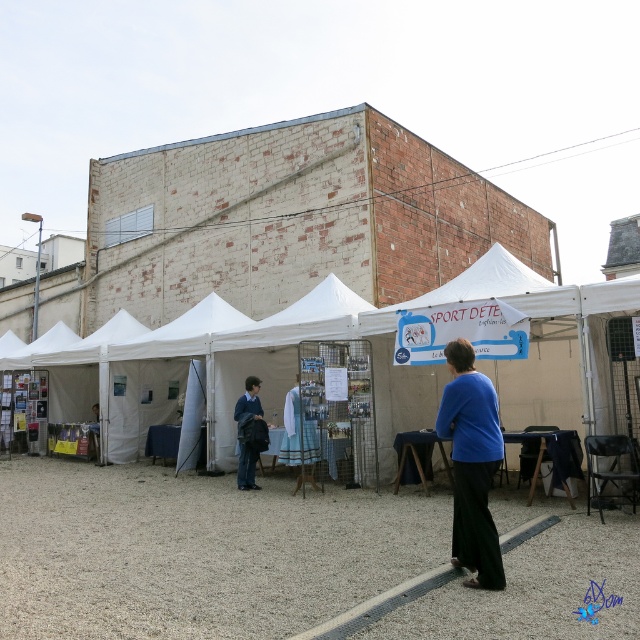
From the picture: You are standing in the courtyard and want to take a photo of the blue matte shirt at center without the white fabric tent at center blocking the view. Is this possible?

The white fabric tent at center is closer to the viewer than the blue matte shirt at center, so the tent will block the view of the shirt. Move behind the tent to take the photo.

You are planning to set up a 3.5 meter long table in the courtyard. The white fabric tent at center and the blue matte shirt at center are in the way. Can you place the table between them without moving any objects?

The distance between the white fabric tent at center and the blue matte shirt at center is 3.71 meters. Since the table is 3.5 meters long, it can fit between them as the available space is slightly larger than the table.

You are standing in the courtyard and want to move towards the two points marked in the scene. Which point, point (486, 497) or point (259, 440), will you reach first?

You will reach point (486, 497) first because it is closer to the viewer than point (259, 440).